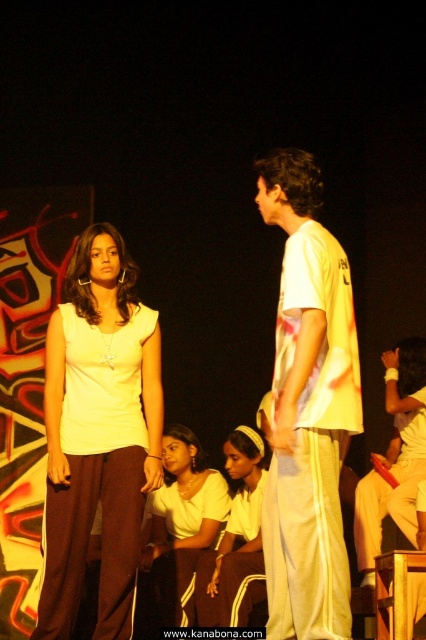
You are an assistant helping to stage a play. You need to place a small prop on the taller object between the matte white blouse at center and the white fabric headband at center. Which object should you choose?

The matte white blouse at center is much taller than the white fabric headband at center, so you should place the prop on the matte white blouse at center.

You are a stagehand who needs to place a 6.5 feet long decorative banner between the matte white top at center and the matte white blouse at center. Will the banner fit without overlapping either of them?

The distance between the matte white top at center and the matte white blouse at center is 7.14 feet. Since the banner is 6.5 feet long, it will fit between them without overlapping as there is enough space.